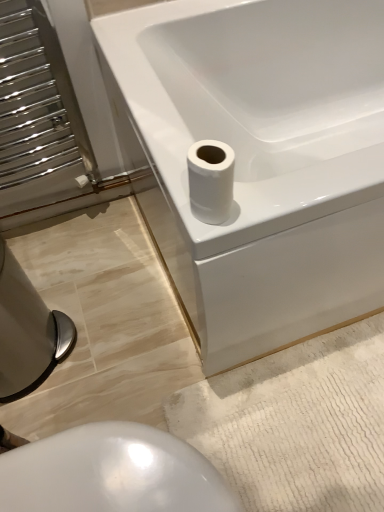
Identify the location of vacant region under brushed metal bidet at lower left, which ranks as the first bidet in left-to-right order (from a real-world perspective). Image resolution: width=384 pixels, height=512 pixels. (47, 353).